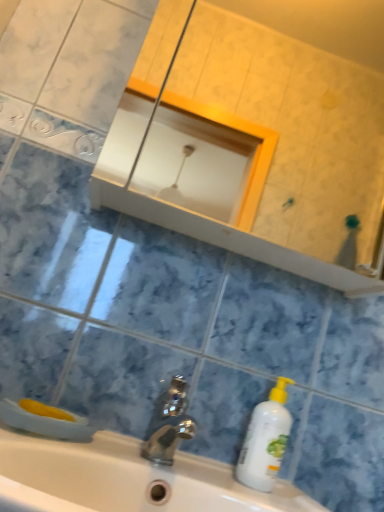
Question: Can you confirm if white plastic bottle at lower right is wider than matte white mirror at upper center?

Choices:
 (A) yes
 (B) no

Answer: (B)

Question: Is white plastic bottle at lower right facing away from matte white mirror at upper center?

Choices:
 (A) no
 (B) yes

Answer: (A)

Question: Does white plastic bottle at lower right appear on the right side of matte white mirror at upper center?

Choices:
 (A) no
 (B) yes

Answer: (A)

Question: From a real-world perspective, is white plastic bottle at lower right physically below matte white mirror at upper center?

Choices:
 (A) no
 (B) yes

Answer: (B)

Question: Is white plastic bottle at lower right not inside matte white mirror at upper center?

Choices:
 (A) no
 (B) yes

Answer: (B)

Question: Can you confirm if white plastic bottle at lower right is shorter than matte white mirror at upper center?

Choices:
 (A) no
 (B) yes

Answer: (B)

Question: Is matte white mirror at upper center at the right side of polished metallic faucet at center?

Choices:
 (A) no
 (B) yes

Answer: (B)

Question: Can you confirm if matte white mirror at upper center is taller than polished metallic faucet at center?

Choices:
 (A) yes
 (B) no

Answer: (A)

Question: Considering the relative sizes of matte white mirror at upper center and polished metallic faucet at center in the image provided, is matte white mirror at upper center bigger than polished metallic faucet at center?

Choices:
 (A) no
 (B) yes

Answer: (B)

Question: From a real-world perspective, does matte white mirror at upper center sit lower than polished metallic faucet at center?

Choices:
 (A) no
 (B) yes

Answer: (A)

Question: From the image's perspective, does matte white mirror at upper center appear lower than polished metallic faucet at center?

Choices:
 (A) no
 (B) yes

Answer: (A)

Question: Is matte white mirror at upper center closer to camera compared to polished metallic faucet at center?

Choices:
 (A) no
 (B) yes

Answer: (A)

Question: Can you confirm if white glossy sink at center is taller than matte white mirror at upper center?

Choices:
 (A) no
 (B) yes

Answer: (A)